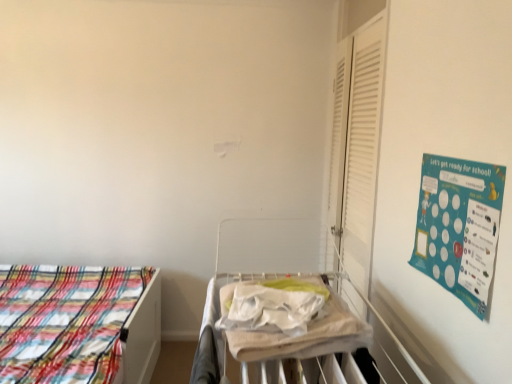
Describe the element at coordinates (77, 324) in the screenshot. I see `plaid fabric bed at left` at that location.

This screenshot has width=512, height=384. Find the location of `teal paperboard at upper right`. teal paperboard at upper right is located at coordinates (x=459, y=226).

Locate an element on the screen. The height and width of the screenshot is (384, 512). plaid fabric bed at left is located at coordinates (77, 324).

Considering the sizes of white fabric hospital bed at center and white matte shutter at right in the image, is white fabric hospital bed at center taller or shorter than white matte shutter at right?

Considering their sizes, white fabric hospital bed at center has less height than white matte shutter at right.

Which object is positioned more to the left, white fabric hospital bed at center or white matte shutter at right?

white fabric hospital bed at center is more to the left.

Looking at this image, would you consider white fabric hospital bed at center to be distant from white matte shutter at right?

No, white fabric hospital bed at center is in close proximity to white matte shutter at right.

How different are the orientations of white fabric hospital bed at center and white matte shutter at right in degrees?

The facing directions of white fabric hospital bed at center and white matte shutter at right are 0.945 degrees apart.

Locate an element on the screen. This screenshot has width=512, height=384. bed below the white matte shutter at right (from a real-world perspective) is located at coordinates (77, 324).

Could you tell me if plaid fabric bed at left is turned towards white matte shutter at right?

No.

Which object is positioned more to the right, plaid fabric bed at left or white matte shutter at right?

white matte shutter at right is more to the right.

Is plaid fabric bed at left outside of beige cotton blanket at center?

Absolutely, plaid fabric bed at left is external to beige cotton blanket at center.

The width and height of the screenshot is (512, 384). Identify the location of bed behind the beige cotton blanket at center. (77, 324).

Can you see plaid fabric bed at left touching beige cotton blanket at center?

No, plaid fabric bed at left is not touching beige cotton blanket at center.

From a real-world perspective, is plaid fabric bed at left physically located above or below beige cotton blanket at center?

plaid fabric bed at left is below beige cotton blanket at center.

From a real-world perspective, which is physically above, teal paperboard at upper right or white fabric hospital bed at center?

teal paperboard at upper right.

Can we say teal paperboard at upper right lies outside white fabric hospital bed at center?

teal paperboard at upper right lies outside white fabric hospital bed at center's area.

Considering the points (479, 286) and (336, 375), which point is in front, point (479, 286) or point (336, 375)?

The point (479, 286) is closer.

Considering their positions, is beige cotton blanket at center located in front of or behind white fabric hospital bed at center?

In the image, beige cotton blanket at center appears behind white fabric hospital bed at center.

From a real-world perspective, between beige cotton blanket at center and white fabric hospital bed at center, who is vertically lower?

white fabric hospital bed at center is physically lower.

Does beige cotton blanket at center have a larger size compared to white fabric hospital bed at center?

No.

Image resolution: width=512 pixels, height=384 pixels. Find the location of `hospital bed lying on the right of beige cotton blanket at center`. hospital bed lying on the right of beige cotton blanket at center is located at coordinates (277, 332).

Between white matte shutter at right and white fabric hospital bed at center, which one appears on the left side from the viewer's perspective?

Positioned to the left is white fabric hospital bed at center.

In the scene shown: Is white matte shutter at right facing away from white fabric hospital bed at center?

No, white matte shutter at right's orientation is not away from white fabric hospital bed at center.

In terms of width, does white matte shutter at right look wider or thinner when compared to white fabric hospital bed at center?

In the image, white matte shutter at right appears to be more narrow than white fabric hospital bed at center.

Considering the sizes of white matte shutter at right and white fabric hospital bed at center in the image, is white matte shutter at right taller or shorter than white fabric hospital bed at center?

Clearly, white matte shutter at right is taller compared to white fabric hospital bed at center.

Consider the image. Can you confirm if white fabric hospital bed at center is smaller than beige cotton blanket at center?

Incorrect, white fabric hospital bed at center is not smaller in size than beige cotton blanket at center.

From the image's perspective, is white fabric hospital bed at center located above beige cotton blanket at center?

No, from the image's perspective, white fabric hospital bed at center is not above beige cotton blanket at center.

Where is `blanket that appears behind the white fabric hospital bed at center`? blanket that appears behind the white fabric hospital bed at center is located at coordinates (305, 334).

Which object is positioned more to the right, white fabric hospital bed at center or beige cotton blanket at center?

From the viewer's perspective, white fabric hospital bed at center appears more on the right side.

In order to click on hospital bed located in front of the white matte shutter at right in this screenshot , I will do `click(277, 332)`.

Identify the location of shutter that is on the right side of plaid fabric bed at left. (356, 148).

When comparing their distances from white matte shutter at right, does teal paperboard at upper right or white fabric hospital bed at center seem further?

The object further to white matte shutter at right is teal paperboard at upper right.

Estimate the real-world distances between objects in this image. Which object is closer to plaid fabric bed at left, white fabric hospital bed at center or white matte shutter at right?

A: white fabric hospital bed at center.

From the image, which object appears to be farther from plaid fabric bed at left, teal paperboard at upper right or white matte shutter at right?

teal paperboard at upper right lies further to plaid fabric bed at left than the other object.

When comparing their distances from plaid fabric bed at left, does white matte shutter at right or teal paperboard at upper right seem closer?

Among the two, white matte shutter at right is located nearer to plaid fabric bed at left.

Looking at the image, which one is located closer to white fabric hospital bed at center, beige cotton blanket at center or white matte shutter at right?

Based on the image, beige cotton blanket at center appears to be nearer to white fabric hospital bed at center.

Based on their spatial positions, is white matte shutter at right or white fabric hospital bed at center closer to plaid fabric bed at left?

white fabric hospital bed at center.

Estimate the real-world distances between objects in this image. Which object is closer to white fabric hospital bed at center, white matte shutter at right or beige cotton blanket at center?

Among the two, beige cotton blanket at center is located nearer to white fabric hospital bed at center.

Based on their spatial positions, is white fabric hospital bed at center or white matte shutter at right further from teal paperboard at upper right?

white matte shutter at right lies further to teal paperboard at upper right than the other object.

The width and height of the screenshot is (512, 384). What are the coordinates of `hospital bed located between plaid fabric bed at left and white matte shutter at right in the left-right direction` in the screenshot? It's located at (277, 332).

This screenshot has width=512, height=384. Find the location of `poster between white fabric hospital bed at center and white matte shutter at right from front to back`. poster between white fabric hospital bed at center and white matte shutter at right from front to back is located at coordinates (459, 226).

Locate an element on the screen. Image resolution: width=512 pixels, height=384 pixels. blanket between teal paperboard at upper right and white fabric hospital bed at center in the vertical direction is located at coordinates (305, 334).

This screenshot has height=384, width=512. What are the coordinates of `shutter between plaid fabric bed at left and teal paperboard at upper right from left to right` in the screenshot? It's located at (356, 148).